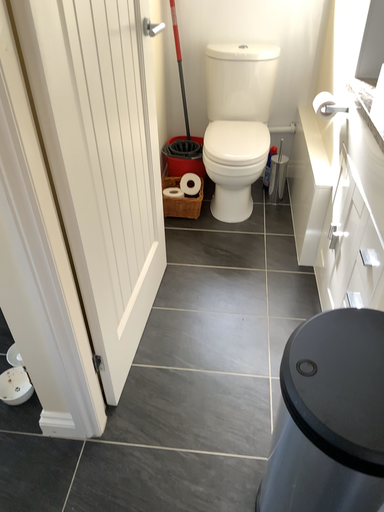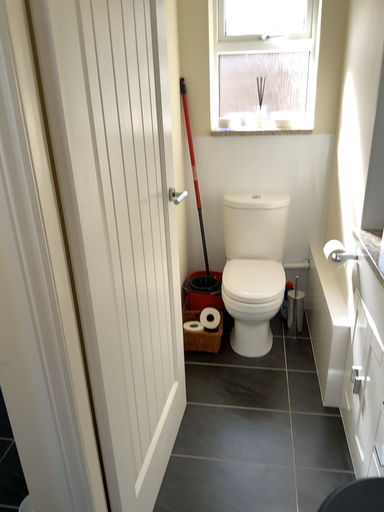
Question: How did the camera likely rotate when shooting the video?

Choices:
 (A) rotated upward
 (B) rotated downward

Answer: (A)